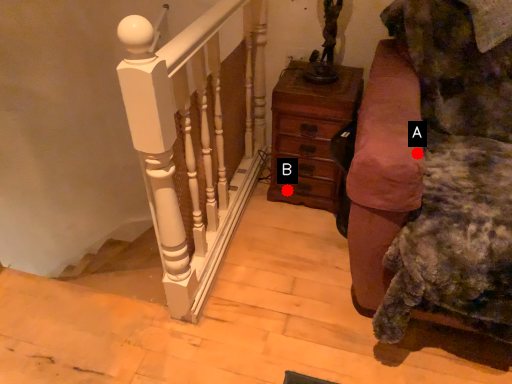
Question: Two points are circled on the image, labeled by A and B beside each circle. Which point is closer to the camera taking this photo?

Choices:
 (A) A is closer
 (B) B is closer

Answer: (A)